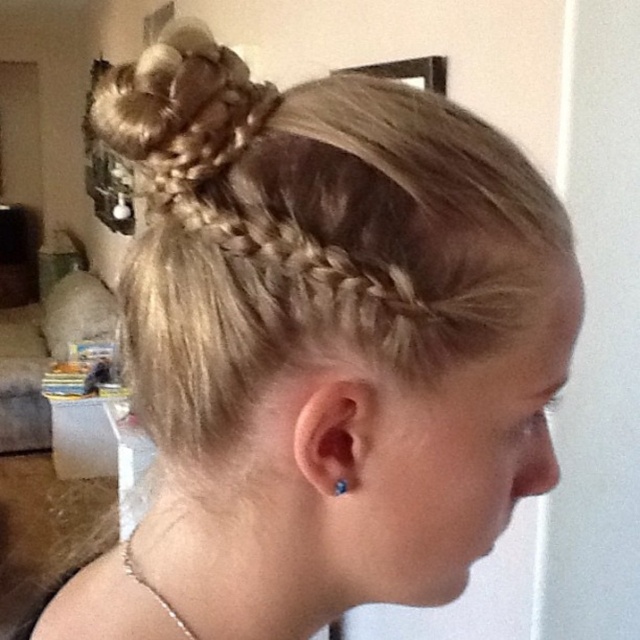
Question: Is silver chain necklace at lower left to the right of blue pearl earring at ear from the viewer's perspective?

Choices:
 (A) yes
 (B) no

Answer: (B)

Question: Is the position of silver chain necklace at lower left less distant than that of blue pearl earring at ear?

Choices:
 (A) yes
 (B) no

Answer: (B)

Question: Which object appears farthest from the camera in this image?

Choices:
 (A) golden braided hair at upper center
 (B) silver chain necklace at lower left
 (C) blue pearl earring at ear

Answer: (B)

Question: Is silver chain necklace at lower left smaller than blue pearl earring at ear?

Choices:
 (A) yes
 (B) no

Answer: (B)

Question: Which object is the closest to the silver chain necklace at lower left?

Choices:
 (A) blue pearl earring at ear
 (B) golden braided hair at upper center

Answer: (A)

Question: Which of the following is the farthest from the observer?

Choices:
 (A) silver chain necklace at lower left
 (B) blue pearl earring at ear
 (C) golden braided hair at upper center

Answer: (A)